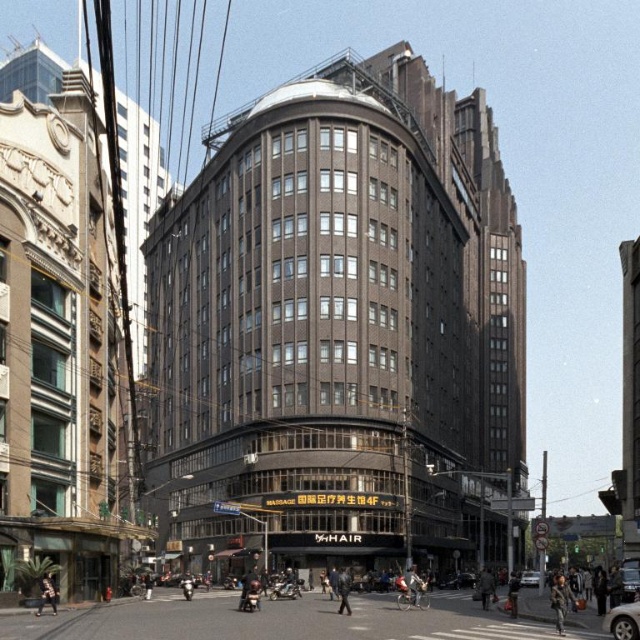
You are a delivery person who needs to place a package on the ground near the dark brown leather jacket at lower left and the silver metallic car at center. Which object should you place the package closer to if you want it to be visible from the street?

The dark brown leather jacket at lower left is positioned over the silver metallic car at center, so placing the package near the dark brown leather jacket at lower left would make it more visible from the street as it is in a higher position.

You are a pedestrian standing at the entrance of the building. You see a silver metallic car at lower right and a denim jacket at lower center. Which object is closer to you?

The silver metallic car at lower right is positioned over denim jacket at lower center, meaning it is closer to you.